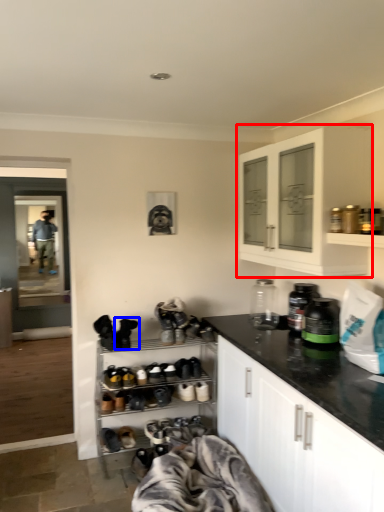
Question: Which object appears farthest to the camera in this image, cabinetry (highlighted by a red box) or footwear (highlighted by a blue box)?

Choices:
 (A) cabinetry
 (B) footwear

Answer: (B)